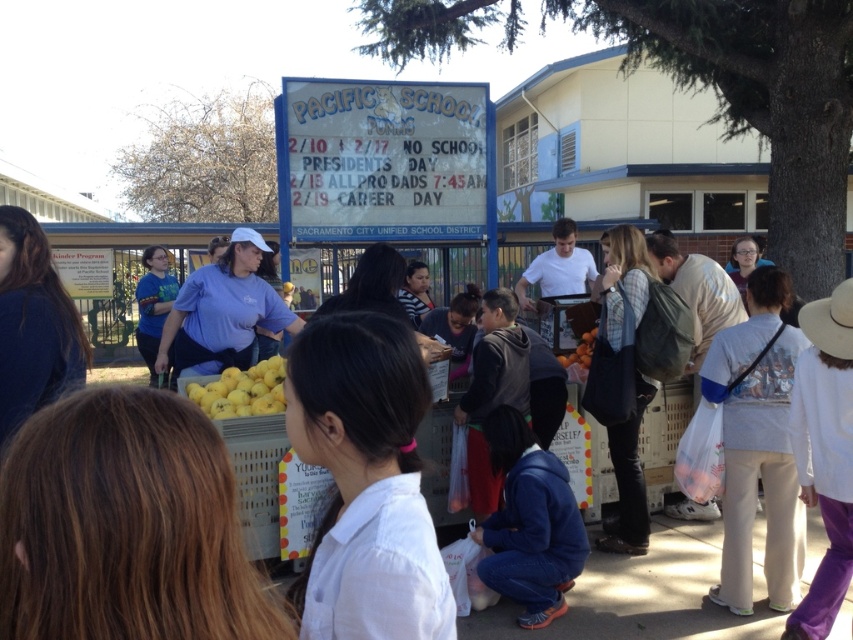
Question: Which object is closer to the camera taking this photo?

Choices:
 (A) white matte shirt at center
 (B) blue fleece jacket at lower center

Answer: (A)

Question: Does blue fleece jacket at lower center appear under orange matte at center?

Choices:
 (A) yes
 (B) no

Answer: (A)

Question: Which point is closer to the camera taking this photo?

Choices:
 (A) (590, 332)
 (B) (253, 396)

Answer: (B)

Question: Which object is closer to the camera taking this photo?

Choices:
 (A) orange matte at center
 (B) blue fleece jacket at lower center

Answer: (B)

Question: Can you confirm if blue fleece jacket at lower center is smaller than orange matte at center?

Choices:
 (A) no
 (B) yes

Answer: (A)

Question: Observing the image, what is the correct spatial positioning of white matte shirt at center in reference to orange matte at center?

Choices:
 (A) below
 (B) above

Answer: (A)